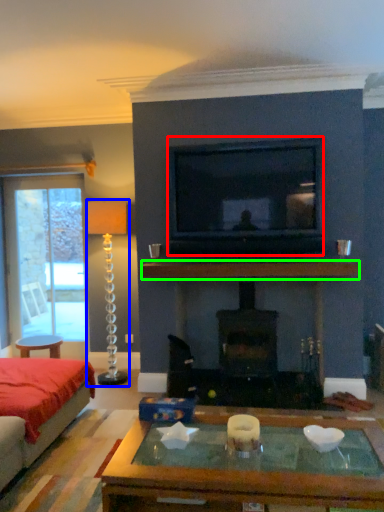
Question: Considering the real-world distances, which object is closest to television (highlighted by a red box)? candle holder (highlighted by a blue box) or mantle (highlighted by a green box).

Choices:
 (A) candle holder
 (B) mantle

Answer: (B)